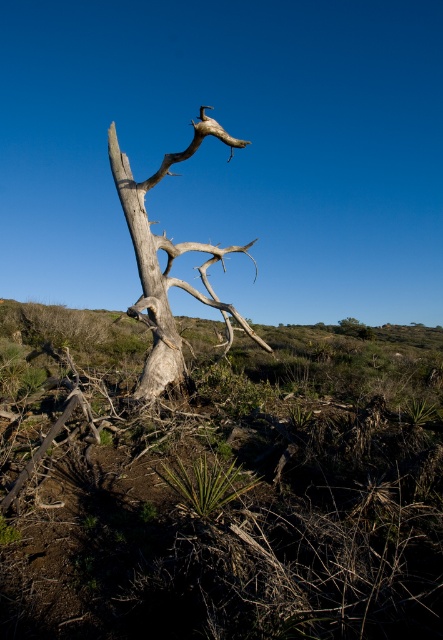
Question: Which object appears farthest from the camera in this image?

Choices:
 (A) gray textured tree trunk at center
 (B) gray rough bark tree trunk at center

Answer: (B)

Question: Which point is closer to the camera taking this photo?

Choices:
 (A) (120, 161)
 (B) (155, 372)

Answer: (B)

Question: Which of the following is the farthest from the observer?

Choices:
 (A) gray textured tree trunk at center
 (B) gray rough bark tree trunk at center

Answer: (B)

Question: Where is gray textured tree trunk at center located in relation to gray rough bark tree trunk at center in the image?

Choices:
 (A) left
 (B) right

Answer: (B)

Question: Does gray textured tree trunk at center appear over gray rough bark tree trunk at center?

Choices:
 (A) yes
 (B) no

Answer: (A)

Question: Is gray textured tree trunk at center closer to camera compared to gray rough bark tree trunk at center?

Choices:
 (A) yes
 (B) no

Answer: (A)